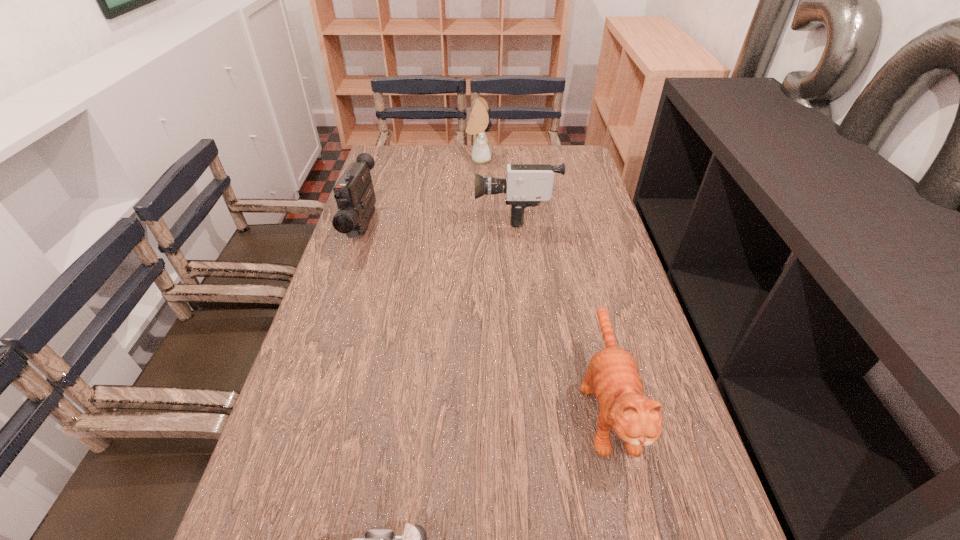
Locate an element on the screen. The height and width of the screenshot is (540, 960). object that is positioned at the left edge is located at coordinates (354, 193).

This screenshot has height=540, width=960. I want to click on object that is at the right edge, so click(x=612, y=376).

Identify the location of free location at the far edge of the desktop. This screenshot has height=540, width=960. (445, 163).

Locate an element on the screen. blank space at the left edge of the desktop is located at coordinates (333, 322).

The width and height of the screenshot is (960, 540). Identify the location of free space at the right edge of the desktop. (618, 297).

Where is `blank space at the far left corner`? This screenshot has height=540, width=960. blank space at the far left corner is located at coordinates (408, 173).

This screenshot has width=960, height=540. In the image, there is a desktop. What are the coordinates of `vacant space at the far right corner` in the screenshot? It's located at (548, 160).

The image size is (960, 540). I want to click on blank region between the farthest object and the cat, so click(x=542, y=281).

Where is `blank region between the cat and the leftmost camcorder`? blank region between the cat and the leftmost camcorder is located at coordinates (485, 315).

Image resolution: width=960 pixels, height=540 pixels. What are the coordinates of `empty location between the rightmost camcorder and the cat` in the screenshot? It's located at (561, 308).